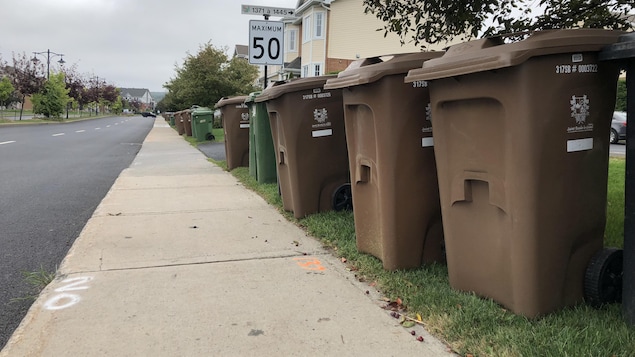
The image size is (635, 357). Find the location of `garbage cans`. garbage cans is located at coordinates (199, 121), (190, 121), (178, 121), (229, 124), (272, 124), (261, 145), (376, 150), (496, 174), (624, 262).